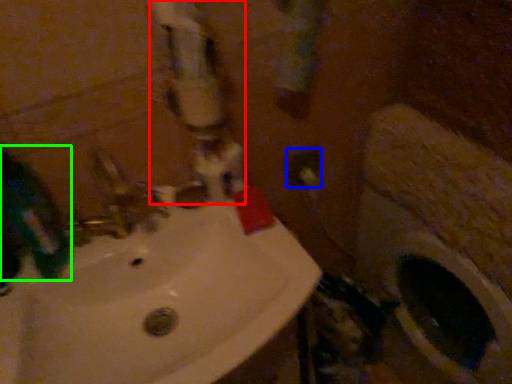
Question: Which is farther away from water pipe (highlighted by a red box)? electric outlet (highlighted by a blue box) or mouthwash (highlighted by a green box)?

Choices:
 (A) electric outlet
 (B) mouthwash

Answer: (A)